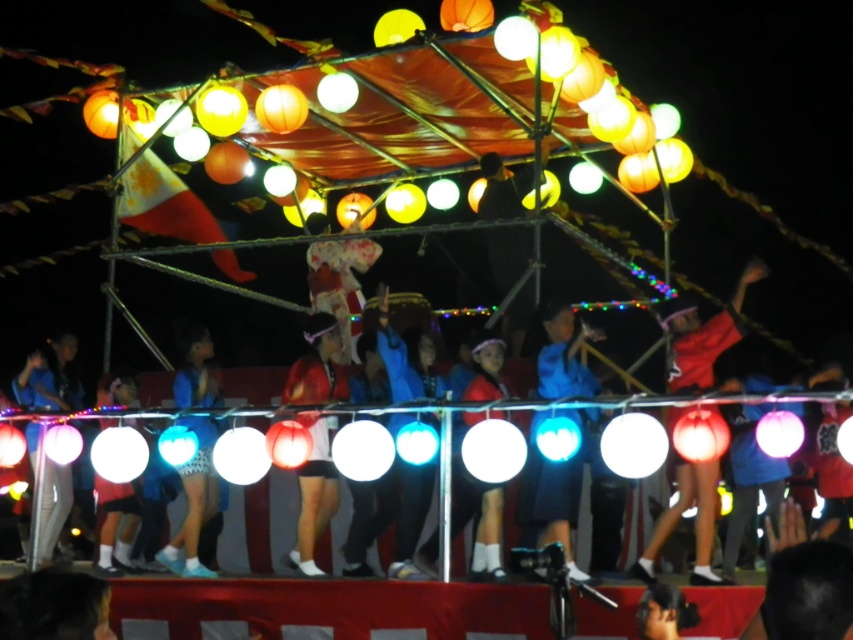
Between red fabric dancer at center and blue fabric at center, which one has less height?

Standing shorter between the two is red fabric dancer at center.

Image resolution: width=853 pixels, height=640 pixels. Identify the location of red fabric dancer at center. (703, 333).

Does white matte pants at lower left appear on the right side of matte white ball at lower left?

In fact, white matte pants at lower left is to the left of matte white ball at lower left.

The height and width of the screenshot is (640, 853). Describe the element at coordinates (49, 378) in the screenshot. I see `white matte pants at lower left` at that location.

What do you see at coordinates (49, 378) in the screenshot?
I see `white matte pants at lower left` at bounding box center [49, 378].

Find the location of `white matte pants at lower left`. white matte pants at lower left is located at coordinates (49, 378).

Looking at this image, does red fabric dancer at center appear on the right side of matte white ball at lower left?

Indeed, red fabric dancer at center is positioned on the right side of matte white ball at lower left.

Who is higher up, red fabric dancer at center or matte white ball at lower left?

red fabric dancer at center is above.

Does point (666, 324) come behind point (137, 508)?

No, it is in front of (137, 508).

Identify the location of red fabric dancer at center. This screenshot has height=640, width=853. (703, 333).